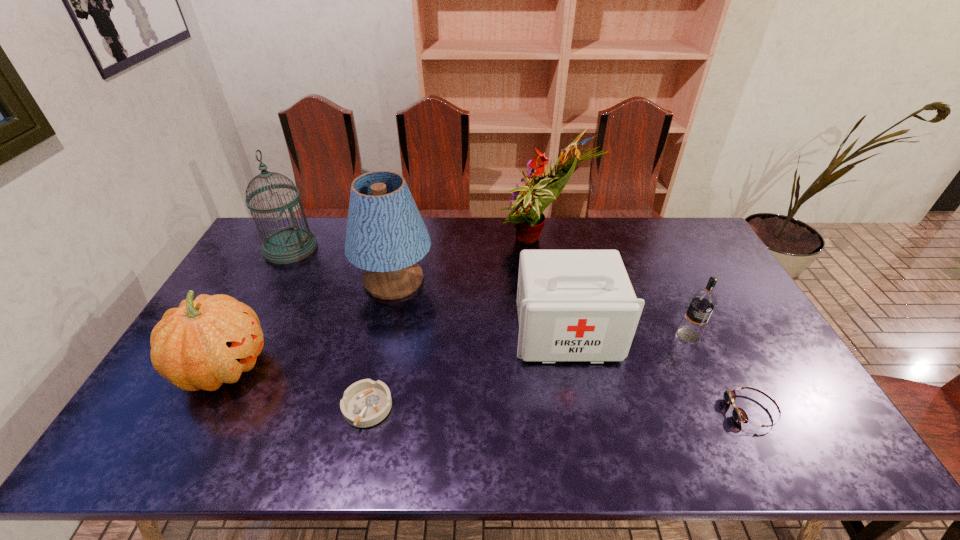
You are a GUI agent. You are given a task and a screenshot of the screen. Output one action in this format:
    pyautogui.click(x=<x>, y=<y>)
    Task: Click on the bouquet positioned at the far edge
    The image size is (960, 540).
    Given the screenshot: What is the action you would take?
    pyautogui.click(x=528, y=202)

Where is `birdcage present at the far edge`? This screenshot has height=540, width=960. birdcage present at the far edge is located at coordinates (288, 245).

The width and height of the screenshot is (960, 540). Find the location of `lampshade that is at the far edge`. lampshade that is at the far edge is located at coordinates (386, 236).

Where is `goggles that is at the near edge`? This screenshot has height=540, width=960. goggles that is at the near edge is located at coordinates (739, 415).

The image size is (960, 540). I want to click on ashtray that is positioned at the near edge, so click(x=365, y=403).

In order to click on birdcage that is at the left edge in this screenshot , I will do `click(288, 245)`.

Locate an element on the screen. The image size is (960, 540). pumpkin present at the left edge is located at coordinates (209, 341).

I want to click on object present at the right edge, so click(739, 415).

At what (x,y) coordinates should I click in order to perform the action: click on object situated at the far left corner. Please return your answer as a coordinate pair (x, y). The width and height of the screenshot is (960, 540). Looking at the image, I should click on (288, 245).

At what (x,y) coordinates should I click in order to perform the action: click on object located in the near right corner section of the desktop. Please return your answer as a coordinate pair (x, y). This screenshot has height=540, width=960. Looking at the image, I should click on (739, 415).